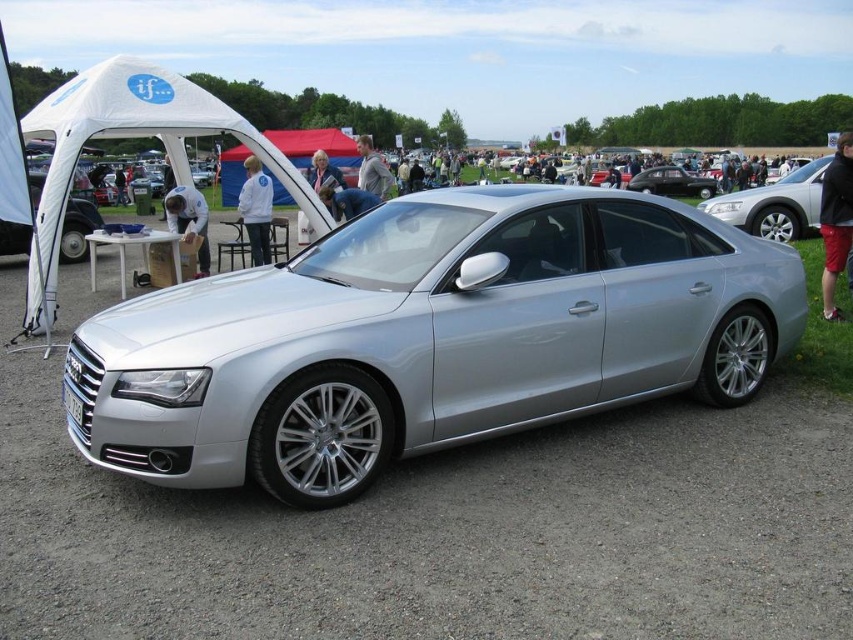
Question: Which of the following is the closest to the observer?

Choices:
 (A) silver metallic car at center
 (B) shiny black car at center
 (C) white fabric tent at center
 (D) satin silver car at center

Answer: (A)

Question: Is silver metallic car at center further to the viewer compared to shiny black car at center?

Choices:
 (A) yes
 (B) no

Answer: (B)

Question: Can you confirm if satin silver car at center is positioned below white fabric tent at center?

Choices:
 (A) no
 (B) yes

Answer: (B)

Question: Which point appears farthest from the camera in this image?

Choices:
 (A) (759, 204)
 (B) (714, 180)
 (C) (340, 161)
 (D) (187, 320)

Answer: (B)

Question: Can you confirm if satin silver car at center is smaller than shiny black car at center?

Choices:
 (A) yes
 (B) no

Answer: (B)

Question: Which of the following is the farthest from the observer?

Choices:
 (A) silver metallic car at center
 (B) white fabric tent at center
 (C) satin silver car at center
 (D) shiny black car at center

Answer: (D)